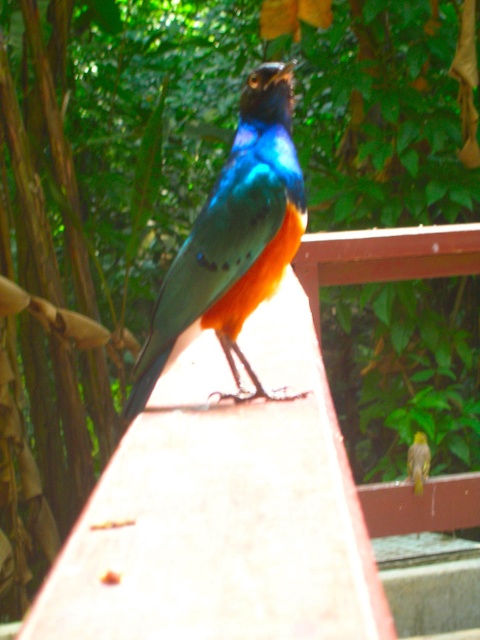
You are standing in a garden and see the shiny metallic bird at center. If you want to approach it without getting too close, what is the minimum distance you should maintain to stay at least 3 feet away?

The shiny metallic bird at center is 4.39 feet away from you. To stay at least 3 feet away, you should maintain a distance of 3 feet or more. Since you are already 4.39 feet away, you can move closer to 3 feet but not less.